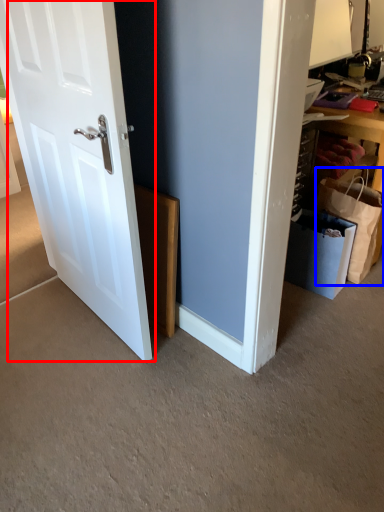
Question: Which point is closer to the camera, door (highlighted by a red box) or shopping bag (highlighted by a blue box)?

Choices:
 (A) door
 (B) shopping bag

Answer: (A)